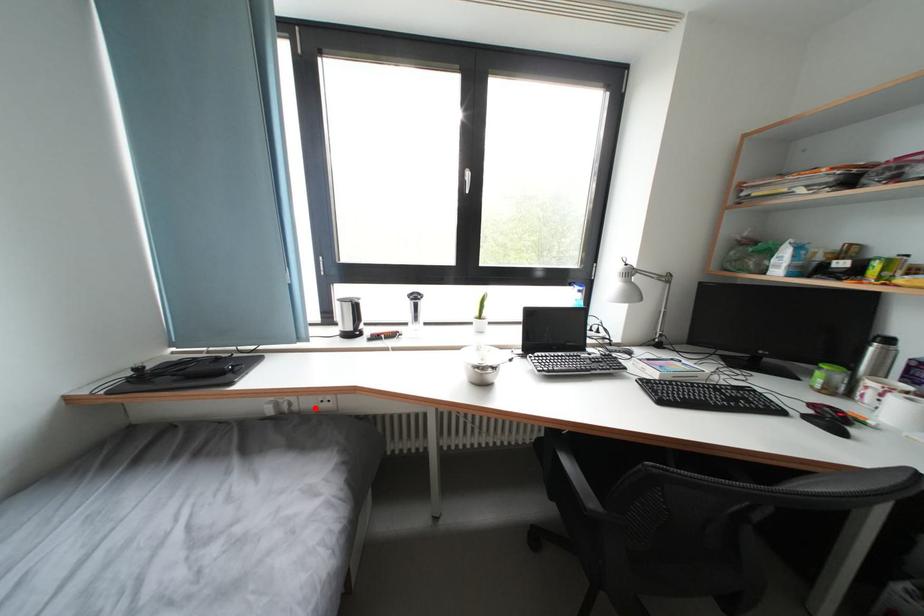
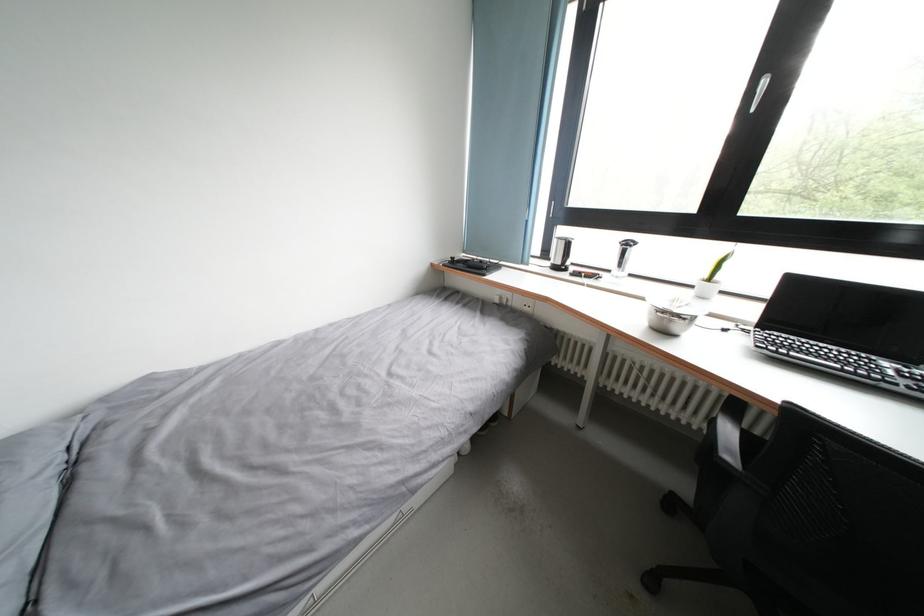
Question: A red point is marked in image1. In image2, is the corresponding 3D point closer to the camera or farther? Reply with the corresponding letter.

Choices:
 (A) The corresponding 3D point is closer.
 (B) The corresponding 3D point is farther.

Answer: (A)